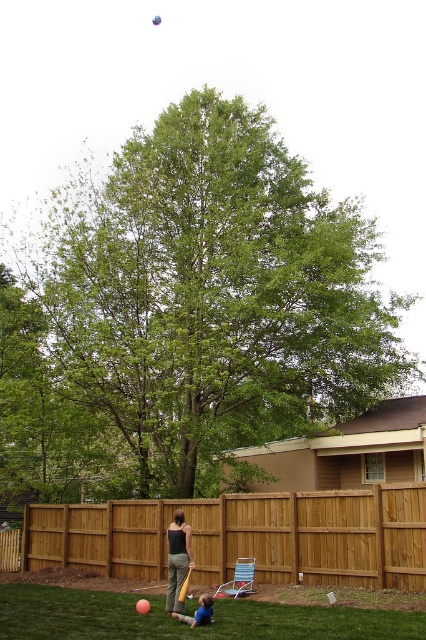
Looking at this image, you are planning to install a new fence in your backyard. The current brown wooden fence at center is blocking your view of the green leafy tree at center. Can you see the tree through the fence?

The green leafy tree at center is located above the brown wooden fence at center, so yes, you can see the tree through the fence because it is positioned higher than the fence.

Based on the photo, you are a painter standing in the backyard and want to paint the dark green fabric pants at center and the orange wood baseball bat at center. Which object should you paint first if you want to start with the one that is higher up?

The dark green fabric pants at center is located above the orange wood baseball bat at center, so you should paint the dark green fabric pants at center first.